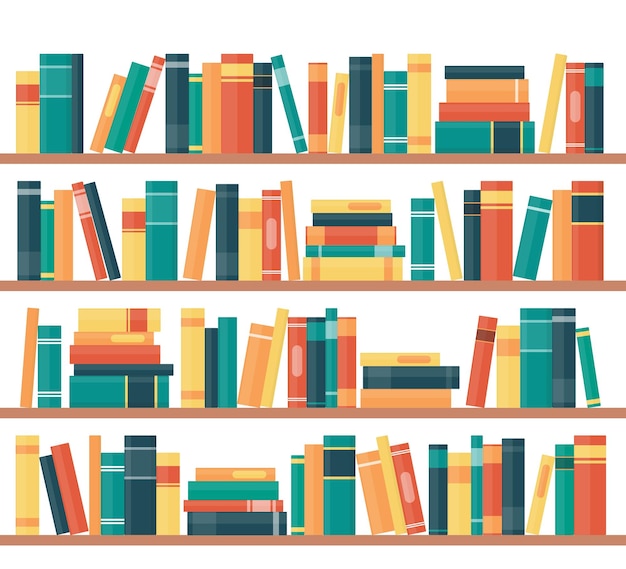
This screenshot has height=569, width=626. What are the coordinates of `horizontal book on bottom shelf` in the screenshot? It's located at (208, 521), (213, 509), (206, 492), (221, 475).